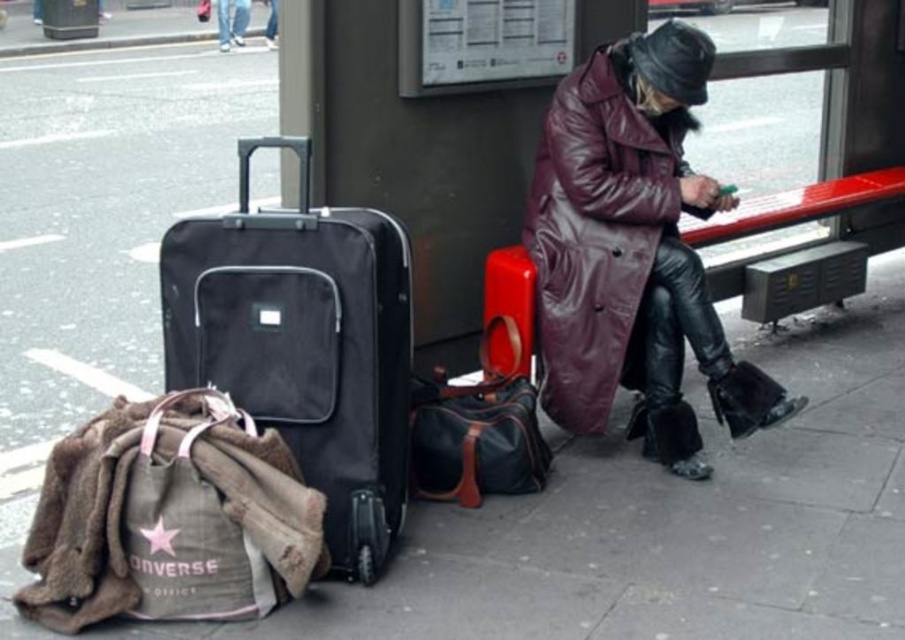
Question: Which point is closer to the camera taking this photo?

Choices:
 (A) (140, 532)
 (B) (249, 10)
 (C) (615, 166)
 (D) (512, 291)

Answer: (A)

Question: Does maroon leather coat at center have a lesser width compared to rubberized red suitcase at center?

Choices:
 (A) yes
 (B) no

Answer: (B)

Question: Is maroon leather coat at center above canvas converse bag at lower left?

Choices:
 (A) yes
 (B) no

Answer: (A)

Question: Which point is closer to the camera taking this photo?

Choices:
 (A) (217, 1)
 (B) (531, 326)
 (C) (341, 467)

Answer: (C)

Question: Is maroon leather coat at center to the left of denim jacket at lower right from the viewer's perspective?

Choices:
 (A) no
 (B) yes

Answer: (A)

Question: Which point is farther from the camera taking this photo?

Choices:
 (A) (460, 468)
 (B) (386, 472)

Answer: (A)